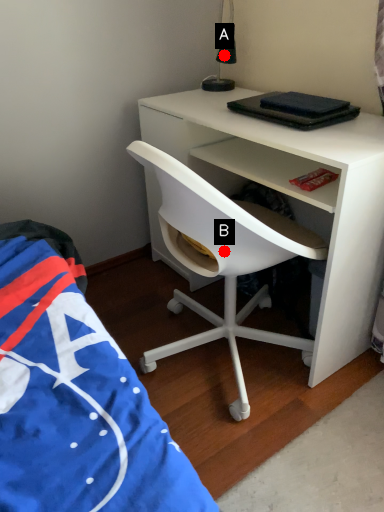
Question: Two points are circled on the image, labeled by A and B beside each circle. Among these points, which one is nearest to the camera?

Choices:
 (A) A is closer
 (B) B is closer

Answer: (B)